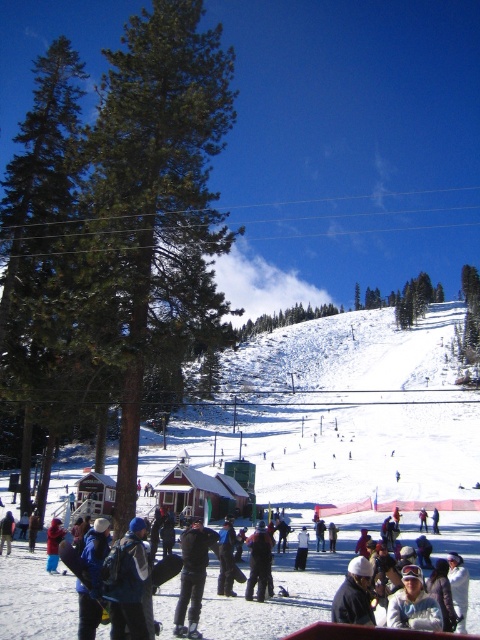
You are a photographer standing at the edge of the ski resort slope. You want to take a photo that includes both the white matte jacket at center and the blue woolen hat at lower left. Which object will appear closer to the bottom of the photo?

The blue woolen hat at lower left will appear closer to the bottom of the photo because it is positioned lower than the white matte jacket at center.

You are a photographer standing at the edge of the ski resort. You want to take a photo that includes both the white powdery snow at center and the dark blue jacket at lower left. Which object should you position closer to the front of your photo to ensure both are visible?

To ensure both the white powdery snow at center and the dark blue jacket at lower left are visible in your photo, position the white powdery snow at center closer to the front since it is already in front of the dark blue jacket at lower left.

You are standing at the camera position and want to hand a jacket to a person wearing the white matte jacket at center. Can you reach them directly without moving?

The white matte jacket at center is 19.09 meters away from camera, so you cannot reach them directly without moving.